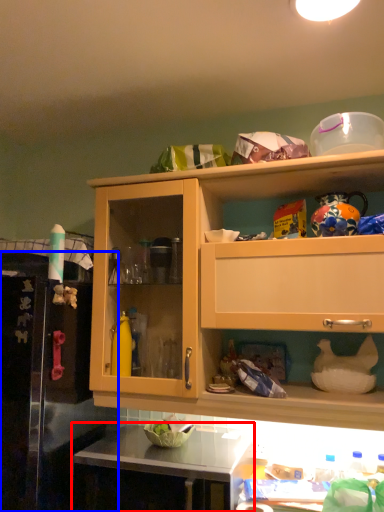
Question: Among these objects, which one is nearest to the camera, countertop (highlighted by a red box) or leftover (highlighted by a blue box)?

Choices:
 (A) countertop
 (B) leftover

Answer: (B)